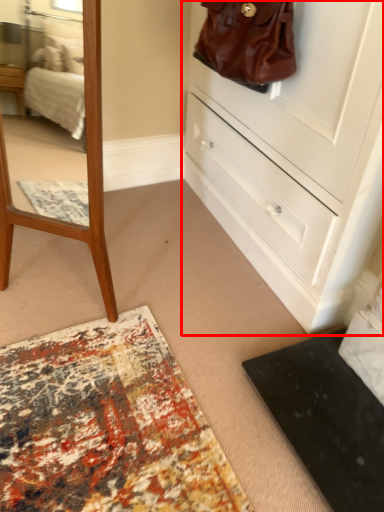
Question: From the image's perspective, what is the correct spatial relationship of chest of drawers (annotated by the red box) in relation to handbag?

Choices:
 (A) below
 (B) above

Answer: (A)